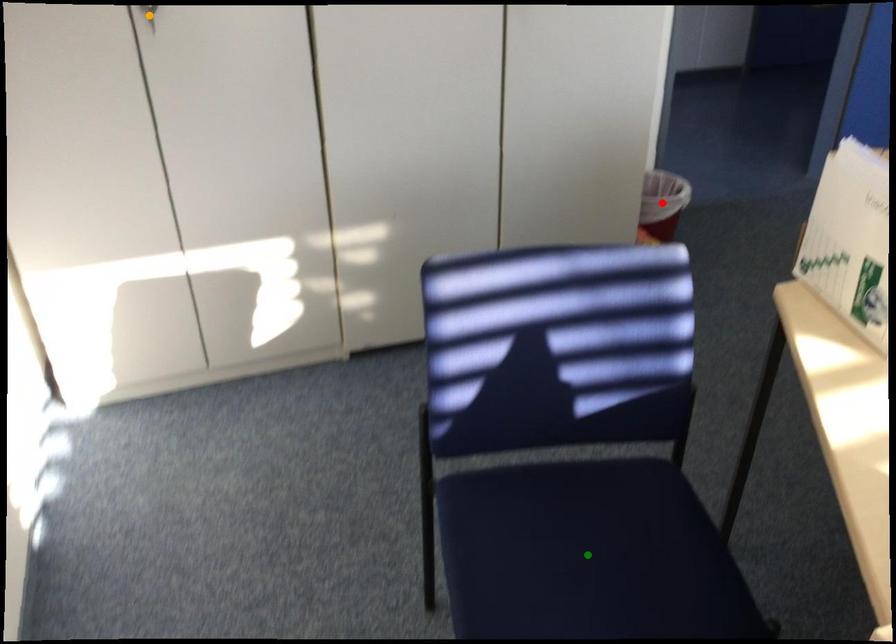
Order these from farthest to nearest:
orange point
red point
green point

red point
orange point
green point